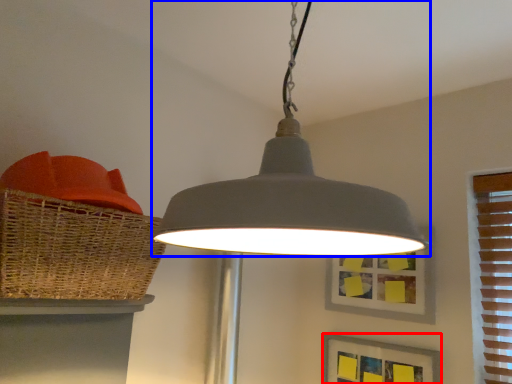
Question: Which of the following is the farthest to the observer, picture frame (highlighted by a red box) or lamp (highlighted by a blue box)?

Choices:
 (A) picture frame
 (B) lamp

Answer: (A)